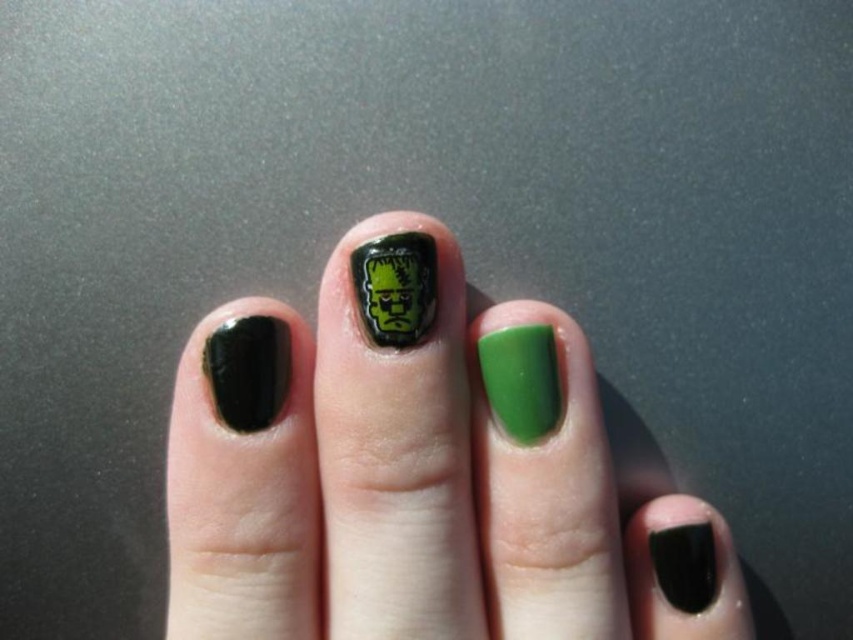
Question: Is black matte nail polish at center left in front of matte black nail polish at lower right?

Choices:
 (A) no
 (B) yes

Answer: (B)

Question: Can you confirm if green matte nail polish at center is smaller than matte black nail polish at lower right?

Choices:
 (A) no
 (B) yes

Answer: (A)

Question: Can you confirm if matte black nail art at center is positioned above matte black nail polish at lower right?

Choices:
 (A) yes
 (B) no

Answer: (A)

Question: Which of these objects is positioned closest to the matte black nail art at center?

Choices:
 (A) matte black nail polish at lower right
 (B) green matte nail polish at center
 (C) glossy green frankenstein nail art at center
 (D) black matte nail polish at center left

Answer: (B)

Question: Which point appears farthest from the camera in this image?

Choices:
 (A) (364, 291)
 (B) (248, 413)
 (C) (537, 390)
 (D) (693, 579)

Answer: (D)

Question: Which of the following is the closest to the observer?

Choices:
 (A) matte black nail polish at lower right
 (B) black matte nail polish at center left
 (C) matte black nail art at center

Answer: (C)